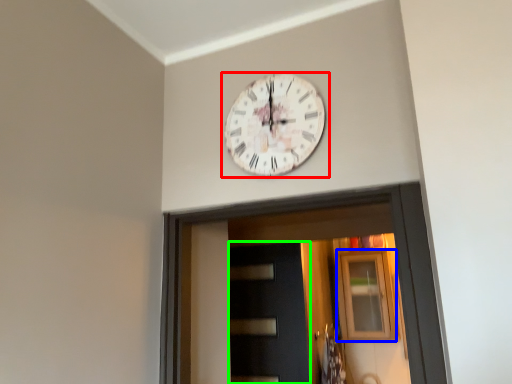
Question: Which object is positioned closest to wall clock (highlighted by a red box)? Select from window (highlighted by a blue box) and door (highlighted by a green box).

Choices:
 (A) window
 (B) door

Answer: (B)